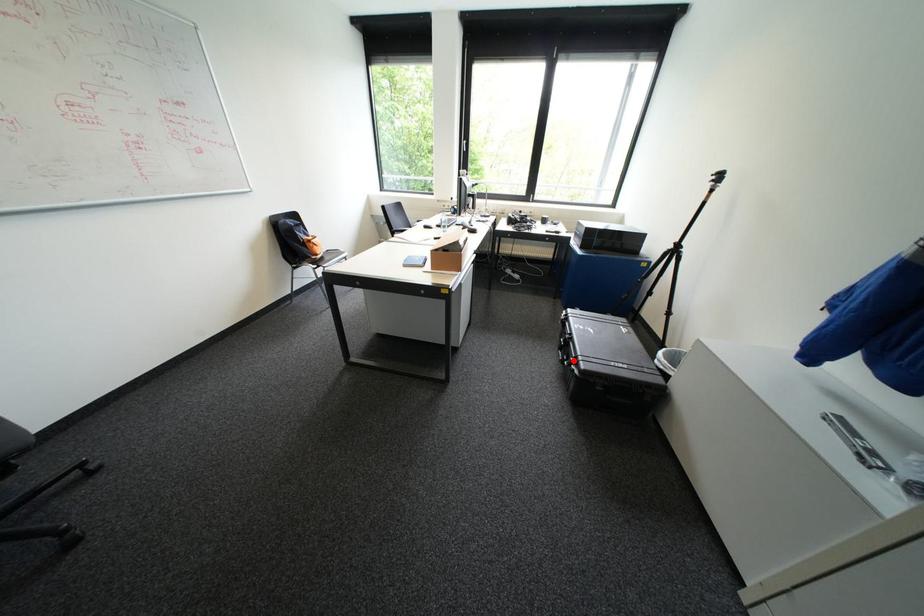
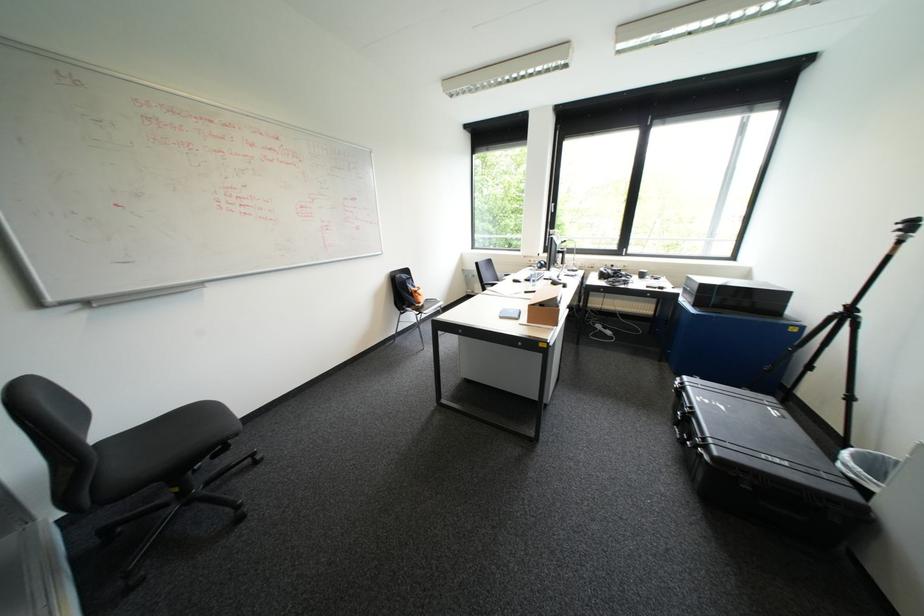
Question: I am providing you with two images of the same scene from different viewpoints. Given a red point in image1, look at the same physical point in image2. Is it:

Choices:
 (A) Closer to the viewpoint
 (B) Farther from the viewpoint

Answer: (B)